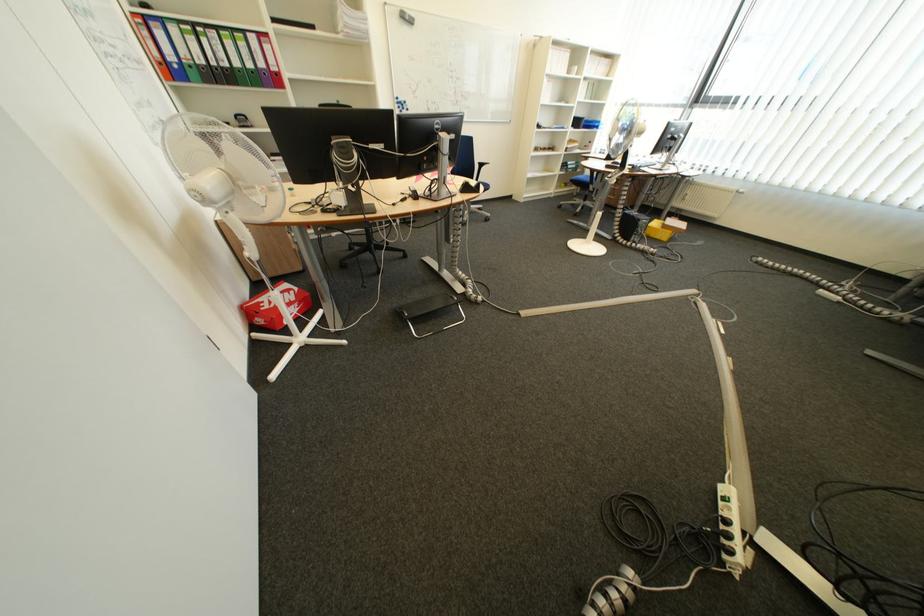
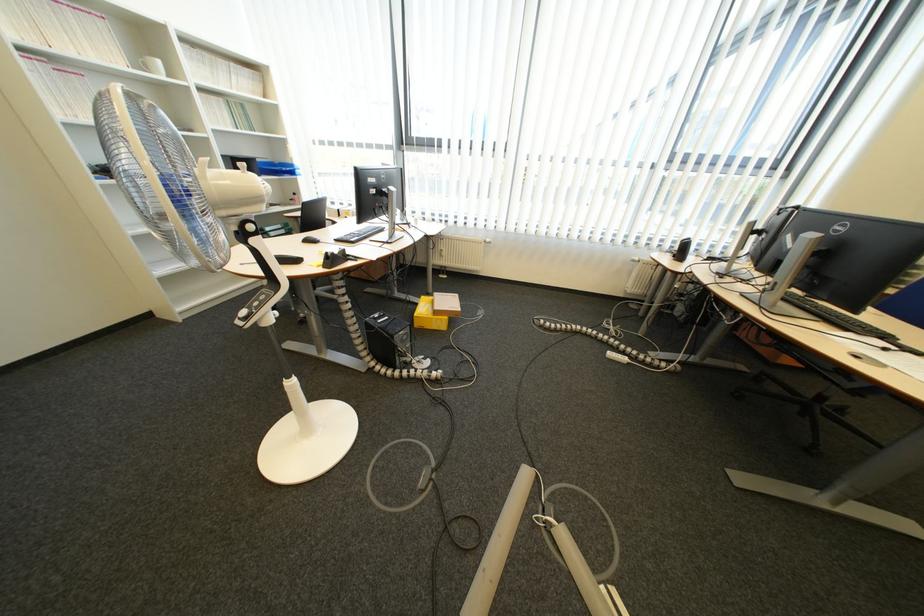
Where in the second image is the point corresponding to (x=682, y=220) from the first image?

(448, 294)